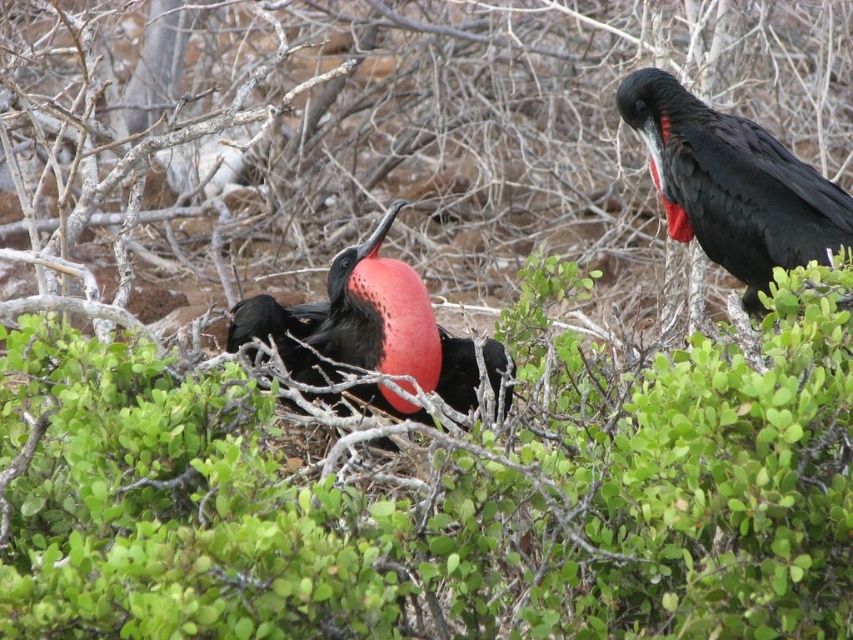
Question: Which object is positioned closest to the green leafy shrub at center?

Choices:
 (A) shiny black bird at upper right
 (B) matte black bird at center

Answer: (B)

Question: Which object appears farthest from the camera in this image?

Choices:
 (A) matte black bird at center
 (B) shiny black bird at upper right

Answer: (B)

Question: Observing the image, what is the correct spatial positioning of shiny black bird at upper right in reference to matte black bird at center?

Choices:
 (A) right
 (B) left

Answer: (A)

Question: Which point appears closest to the camera in this image?

Choices:
 (A) (635, 74)
 (B) (393, 209)

Answer: (B)

Question: Where is green leafy shrub at center located in relation to shiny black bird at upper right in the image?

Choices:
 (A) below
 (B) above

Answer: (A)

Question: Is green leafy shrub at center thinner than matte black bird at center?

Choices:
 (A) no
 (B) yes

Answer: (A)